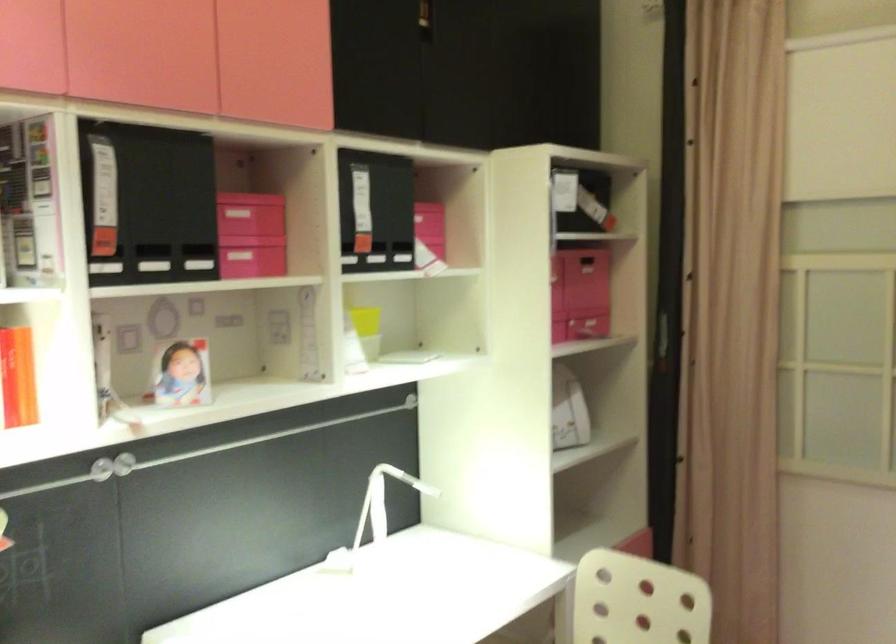
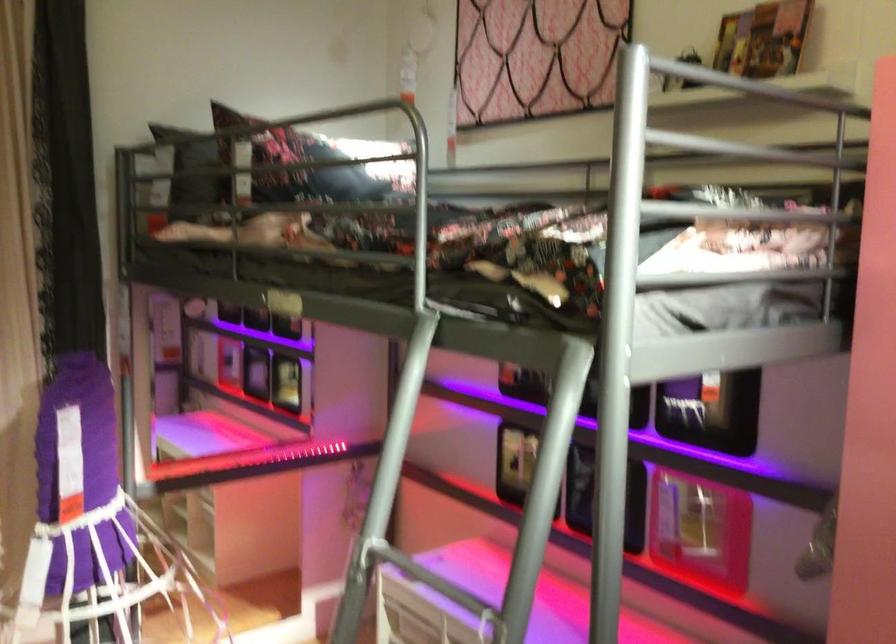
Question: The camera is either moving clockwise (left) or counter-clockwise (right) around the object. The first image is from the beginning of the video and the second image is from the end. Is the camera moving left or right when shooting the video?

Choices:
 (A) Left
 (B) Right

Answer: (A)